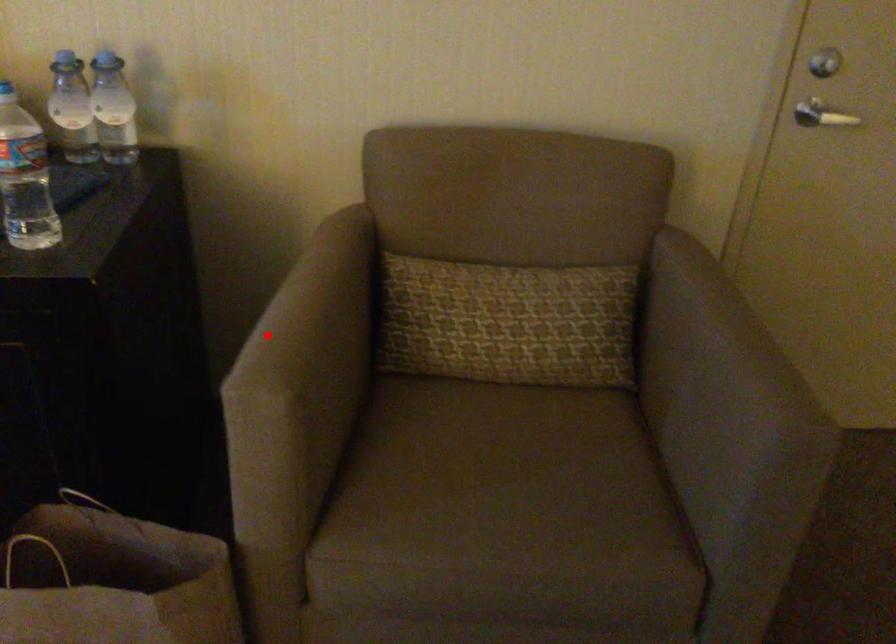
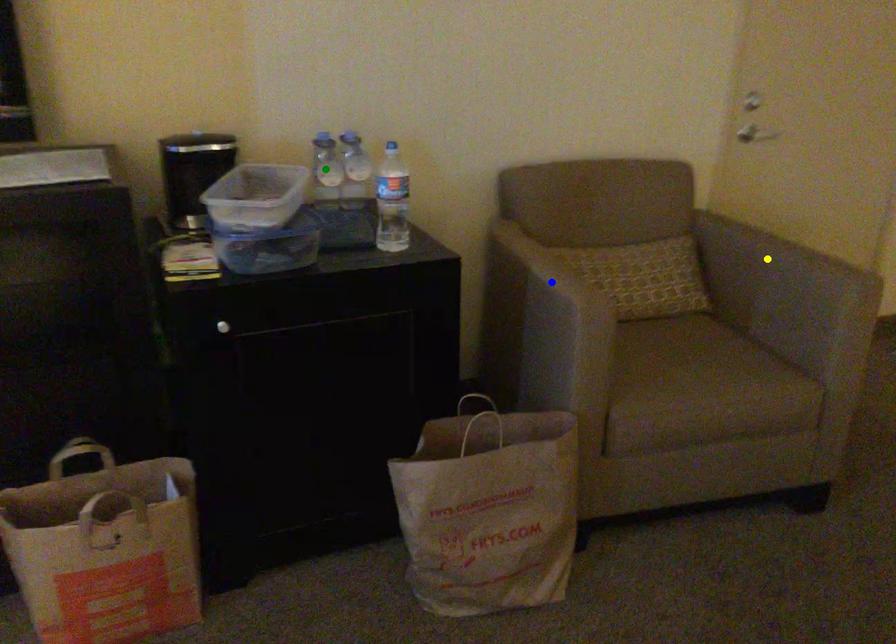
Question: I am providing you with two images of the same scene from different viewpoints. A red point is marked on the first image. You are given multiple points on the second image. Which spot in image 2 lines up with the point in image 1?

Choices:
 (A) green point
 (B) yellow point
 (C) blue point

Answer: (C)